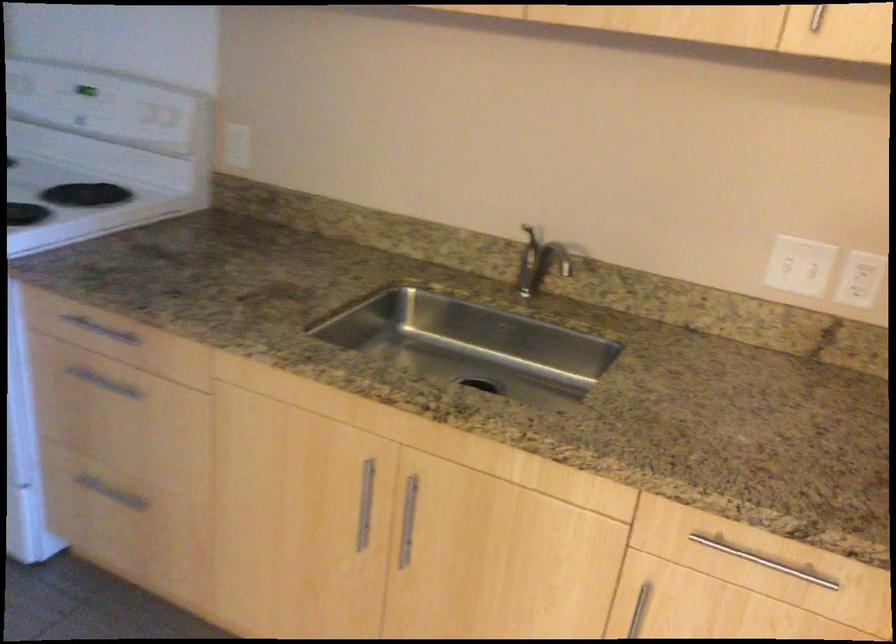
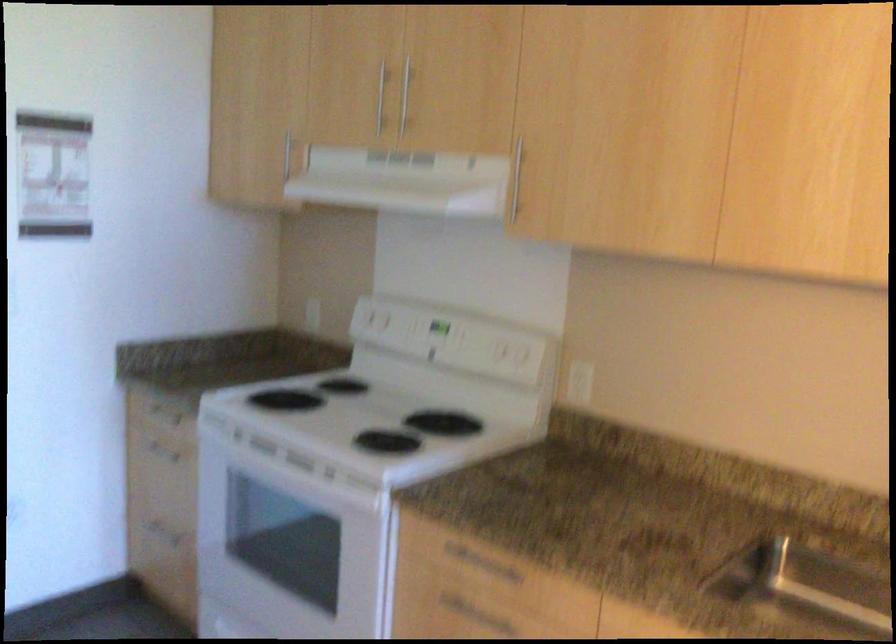
Question: Which direction would the cameraman need to move to produce the second image? Reply with the corresponding letter.

Choices:
 (A) Left
 (B) Right
 (C) Forward
 (D) Backward

Answer: (A)